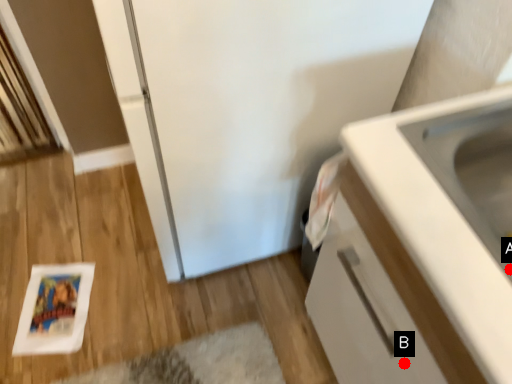
Question: Two points are circled on the image, labeled by A and B beside each circle. Which point appears farthest from the camera in this image?

Choices:
 (A) A is further
 (B) B is further

Answer: (B)